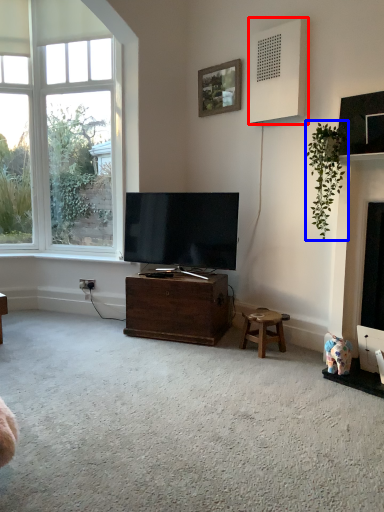
Question: Which of the following is the closest to the observer, speaker (highlighted by a red box) or houseplant (highlighted by a blue box)?

Choices:
 (A) speaker
 (B) houseplant

Answer: (B)